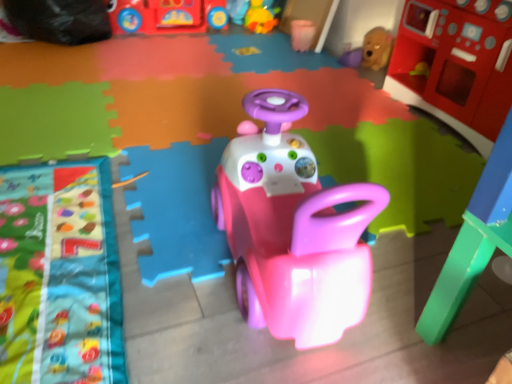
Question: Does pink plastic cup at upper center, acting as the 4th toy starting from the left, turn towards shiny plastic bus at upper center, which is counted as the sixth toy, starting from the right?

Choices:
 (A) yes
 (B) no

Answer: (B)

Question: From a real-world perspective, is pink plastic cup at upper center, which ranks as the 3th toy in right-to-left order, on shiny plastic bus at upper center, which is counted as the sixth toy, starting from the right?

Choices:
 (A) no
 (B) yes

Answer: (A)

Question: From the image's perspective, is pink plastic cup at upper center, acting as the 4th toy starting from the left, located above shiny plastic bus at upper center, which is counted as the sixth toy, starting from the right?

Choices:
 (A) yes
 (B) no

Answer: (B)

Question: Would you say pink plastic cup at upper center, which ranks as the 3th toy in right-to-left order, is outside shiny plastic bus at upper center, marked as the 1th toy in a left-to-right arrangement?

Choices:
 (A) yes
 (B) no

Answer: (A)

Question: Is pink plastic cup at upper center, which ranks as the 3th toy in right-to-left order, not close to shiny plastic bus at upper center, which is counted as the sixth toy, starting from the right?

Choices:
 (A) yes
 (B) no

Answer: (B)

Question: Considering the relative sizes of pink plastic cup at upper center, which ranks as the 3th toy in right-to-left order, and shiny plastic bus at upper center, marked as the 1th toy in a left-to-right arrangement, in the image provided, is pink plastic cup at upper center, which ranks as the 3th toy in right-to-left order, taller than shiny plastic bus at upper center, marked as the 1th toy in a left-to-right arrangement,?

Choices:
 (A) no
 (B) yes

Answer: (A)

Question: Is pink plastic car at center, positioned as the third toy in left-to-right order, positioned far away from matte brown teddy bear at upper right, acting as the 2th toy starting from the right?

Choices:
 (A) yes
 (B) no

Answer: (A)

Question: Is pink plastic car at center, the fourth toy viewed from the right, facing away from matte brown teddy bear at upper right, which is counted as the fifth toy, starting from the left?

Choices:
 (A) no
 (B) yes

Answer: (A)

Question: Is matte brown teddy bear at upper right, which is counted as the fifth toy, starting from the left, located within pink plastic car at center, the fourth toy viewed from the right?

Choices:
 (A) no
 (B) yes

Answer: (A)

Question: Is pink plastic car at center, the fourth toy viewed from the right, positioned beyond the bounds of matte brown teddy bear at upper right, which is counted as the fifth toy, starting from the left?

Choices:
 (A) yes
 (B) no

Answer: (A)

Question: Is pink plastic car at center, the fourth toy viewed from the right, further to camera compared to matte brown teddy bear at upper right, acting as the 2th toy starting from the right?

Choices:
 (A) no
 (B) yes

Answer: (A)

Question: Can you confirm if pink plastic car at center, positioned as the third toy in left-to-right order, is positioned to the left of matte brown teddy bear at upper right, acting as the 2th toy starting from the right?

Choices:
 (A) no
 (B) yes

Answer: (B)

Question: From the image's perspective, is rubberized red play kitchen at upper right, marked as the sixth toy in a left-to-right arrangement, on pink plastic car at center, the fourth toy viewed from the right?

Choices:
 (A) no
 (B) yes

Answer: (B)